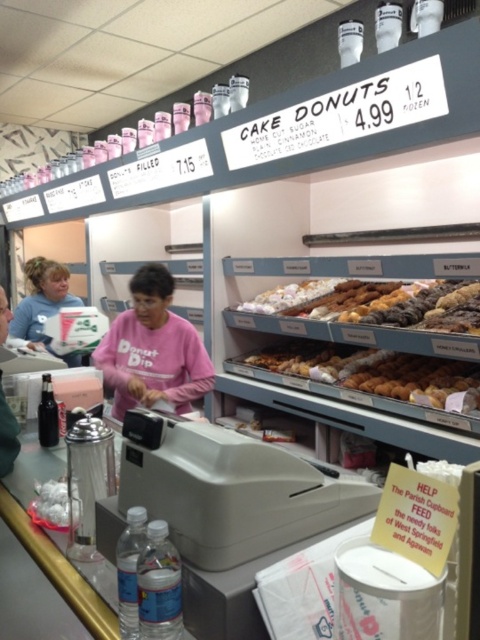
Does pink cotton shirt at center have a greater width compared to white plastic bag at lower left?

Correct, the width of pink cotton shirt at center exceeds that of white plastic bag at lower left.

This screenshot has height=640, width=480. I want to click on pink cotton shirt at center, so click(153, 349).

Locate an element on the screen. The width and height of the screenshot is (480, 640). pink cotton shirt at center is located at coordinates (153, 349).

Can you confirm if golden brown doughnut at center is positioned to the right of matte blue shirt at upper left?

Yes, golden brown doughnut at center is to the right of matte blue shirt at upper left.

Who is positioned more to the left, golden brown doughnut at center or matte blue shirt at upper left?

From the viewer's perspective, matte blue shirt at upper left appears more on the left side.

Measure the distance between golden brown doughnut at center and camera.

golden brown doughnut at center and camera are 6.41 feet apart from each other.

You are a GUI agent. You are given a task and a screenshot of the screen. Output one action in this format:
    pyautogui.click(x=<x>, y=<y>)
    Task: Click on the golden brown doughnut at center
    Image resolution: width=480 pixels, height=640 pixels.
    Given the screenshot: What is the action you would take?
    pyautogui.click(x=377, y=374)

Based on the photo, is pink cotton shirt at center below matte blue shirt at upper left?

Yes, pink cotton shirt at center is below matte blue shirt at upper left.

Which is below, pink cotton shirt at center or matte blue shirt at upper left?

pink cotton shirt at center is lower down.

Identify the location of pink cotton shirt at center. Image resolution: width=480 pixels, height=640 pixels. (153, 349).

Image resolution: width=480 pixels, height=640 pixels. Identify the location of pink cotton shirt at center. (153, 349).